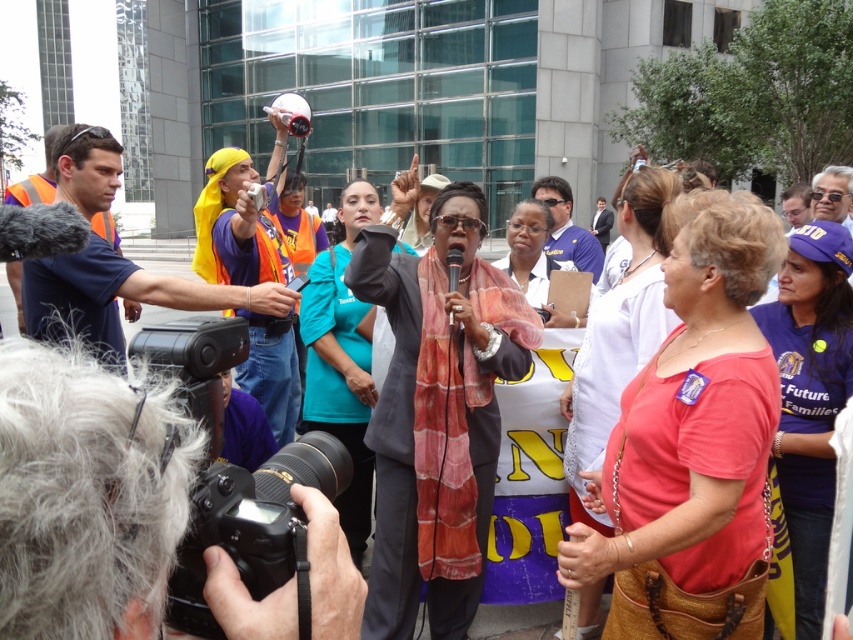
Which is more to the right, orange reflective vest at left or black plastic camera at lower left?

From the viewer's perspective, black plastic camera at lower left appears more on the right side.

Is point (71, 128) less distant than point (276, 497)?

No, it is behind (276, 497).

What are the coordinates of `orange reflective vest at left` in the screenshot? It's located at (119, 296).

Where is `orange reflective vest at left`? orange reflective vest at left is located at coordinates (119, 296).

Does black plastic camera at lower left have a greater width compared to blue fabric shirt at center?

Incorrect, black plastic camera at lower left's width does not surpass blue fabric shirt at center's.

Does point (338, 488) lie in front of point (560, 252)?

Yes, point (338, 488) is in front of point (560, 252).

What are the coordinates of `black plastic camera at lower left` in the screenshot? It's located at (x=253, y=529).

Between orange reflective vest at left and blue fabric shirt at center, which one has more height?

orange reflective vest at left

Which is behind, point (184, 305) or point (572, 195)?

Positioned behind is point (572, 195).

I want to click on orange reflective vest at left, so click(119, 296).